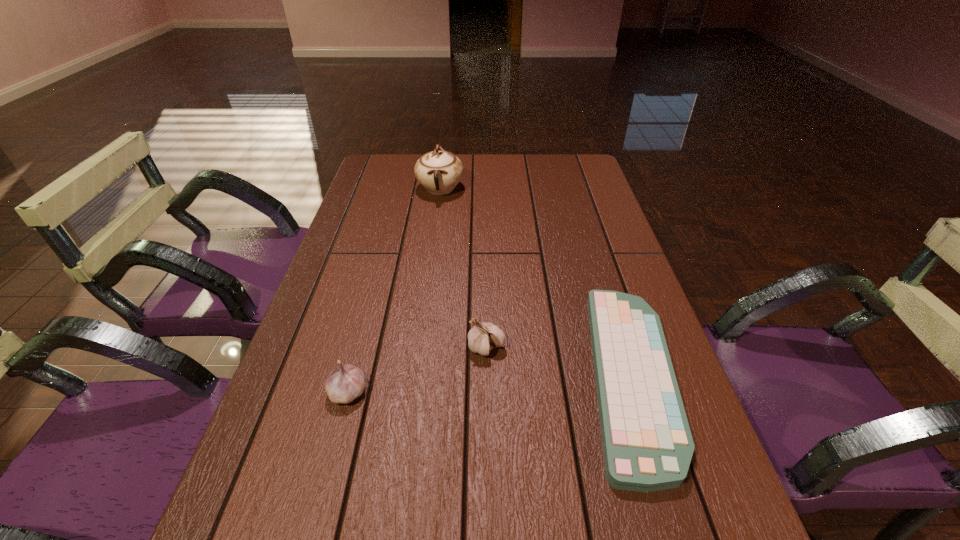
Where is `unoccupied position between the farther garlic and the second object from left to right`? This screenshot has width=960, height=540. unoccupied position between the farther garlic and the second object from left to right is located at coordinates (464, 268).

Find the location of a particular element. This screenshot has height=540, width=960. free space between the tallest object and the right garlic is located at coordinates (464, 268).

Identify the location of free space between the second object from right to left and the rightmost object. 559,362.

Locate an element on the screen. The width and height of the screenshot is (960, 540). unoccupied area between the farthest object and the computer keyboard is located at coordinates (536, 282).

You are a GUI agent. You are given a task and a screenshot of the screen. Output one action in this format:
    pyautogui.click(x=<x>, y=<y>)
    Task: Click on the empty space between the leftmost object and the shortest object
    Image resolution: width=960 pixels, height=540 pixels.
    Given the screenshot: What is the action you would take?
    coord(490,384)

Locate an element on the screen. free spot between the chinaware and the left garlic is located at coordinates click(x=395, y=290).

This screenshot has height=540, width=960. In order to click on free area in between the farther garlic and the computer keyboard in this screenshot , I will do `click(559, 362)`.

Locate an element on the screen. The width and height of the screenshot is (960, 540). free point between the left garlic and the chinaware is located at coordinates (395, 290).

Find the location of a particular element. Image resolution: width=960 pixels, height=540 pixels. vacant space that's between the nearer garlic and the rightmost object is located at coordinates (490, 384).

Find the location of a particular element. The width and height of the screenshot is (960, 540). object that stands as the second closest to the farther garlic is located at coordinates (346, 382).